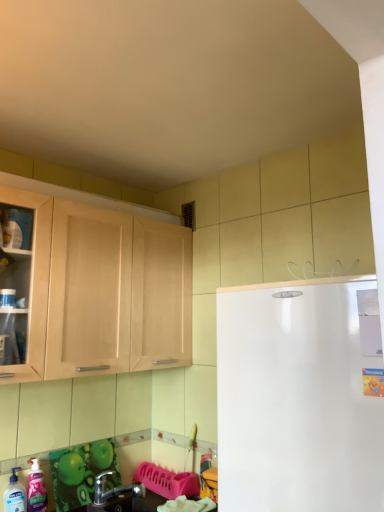
Question: Is pink glossy liquid soap at lower left, placed as the 1th cleaning product when sorted from right to left, to the right of metallic silver faucet at lower left from the viewer's perspective?

Choices:
 (A) no
 (B) yes

Answer: (A)

Question: Does pink glossy liquid soap at lower left, placed as the 1th cleaning product when sorted from right to left, have a lesser height compared to metallic silver faucet at lower left?

Choices:
 (A) yes
 (B) no

Answer: (B)

Question: Considering the relative sizes of pink glossy liquid soap at lower left, positioned as the 2th cleaning product in left-to-right order, and metallic silver faucet at lower left in the image provided, is pink glossy liquid soap at lower left, positioned as the 2th cleaning product in left-to-right order, thinner than metallic silver faucet at lower left?

Choices:
 (A) yes
 (B) no

Answer: (A)

Question: Can you confirm if pink glossy liquid soap at lower left, placed as the 1th cleaning product when sorted from right to left, is bigger than metallic silver faucet at lower left?

Choices:
 (A) yes
 (B) no

Answer: (B)

Question: From a real-world perspective, is pink glossy liquid soap at lower left, positioned as the 2th cleaning product in left-to-right order, positioned over metallic silver faucet at lower left based on gravity?

Choices:
 (A) no
 (B) yes

Answer: (B)

Question: Is green glossy countertop at lower left wider or thinner than pink glossy liquid soap at lower left, positioned as the 2th cleaning product in left-to-right order?

Choices:
 (A) thin
 (B) wide

Answer: (B)

Question: Does point (109, 509) appear closer or farther from the camera than point (33, 499)?

Choices:
 (A) closer
 (B) farther

Answer: (B)

Question: Would you say green glossy countertop at lower left is to the left or to the right of pink glossy liquid soap at lower left, positioned as the 2th cleaning product in left-to-right order, in the picture?

Choices:
 (A) left
 (B) right

Answer: (B)

Question: In the image, is green glossy countertop at lower left positioned in front of or behind pink glossy liquid soap at lower left, placed as the 1th cleaning product when sorted from right to left?

Choices:
 (A) behind
 (B) front

Answer: (B)

Question: From the image's perspective, is pink glossy liquid soap at lower left, placed as the 1th cleaning product when sorted from right to left, located above or below green glossy countertop at lower left?

Choices:
 (A) below
 (B) above

Answer: (B)

Question: Is pink glossy liquid soap at lower left, placed as the 1th cleaning product when sorted from right to left, situated inside green glossy countertop at lower left or outside?

Choices:
 (A) outside
 (B) inside

Answer: (A)

Question: From a real-world perspective, is pink glossy liquid soap at lower left, positioned as the 2th cleaning product in left-to-right order, physically located above or below green glossy countertop at lower left?

Choices:
 (A) below
 (B) above

Answer: (B)

Question: Is pink glossy liquid soap at lower left, placed as the 1th cleaning product when sorted from right to left, to the left or to the right of green glossy countertop at lower left in the image?

Choices:
 (A) left
 (B) right

Answer: (A)

Question: Visually, is green glossy countertop at lower left positioned to the left or to the right of white smooth refrigerator at right?

Choices:
 (A) right
 (B) left

Answer: (B)

Question: From the image's perspective, is green glossy countertop at lower left located above or below white smooth refrigerator at right?

Choices:
 (A) below
 (B) above

Answer: (A)